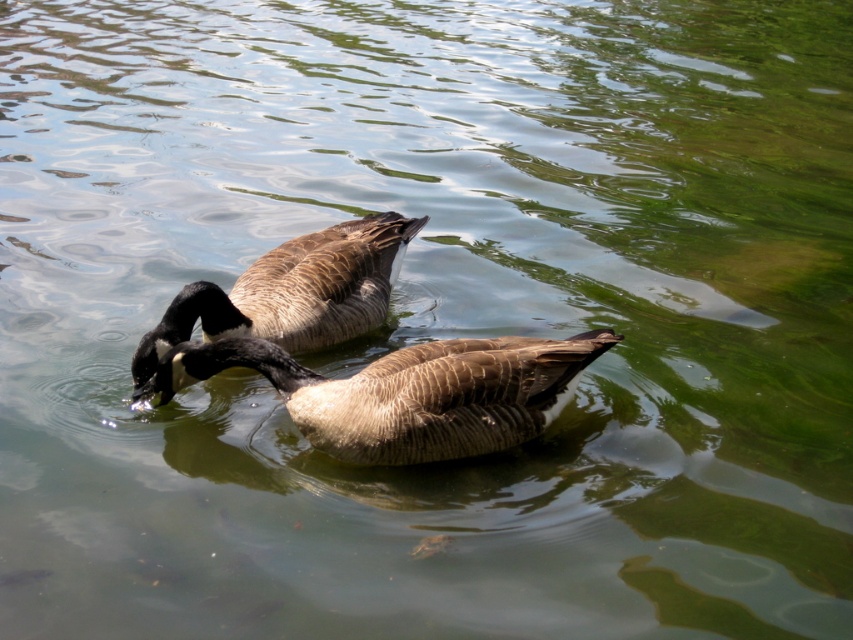
You are a birdwatcher observing two ducks in the water. You notice a brown textured duck at center and a brown feathered duck at center. Which duck is positioned lower in the water?

The brown textured duck at center is located below the brown feathered duck at center, so it is positioned lower in the water.

You are a wildlife photographer observing two ducks in the center of a pond. You notice a brown textured duck at center and a brown feathered duck at center. Which duck is larger?

The brown feathered duck at center is larger than the brown textured duck at center.

You are a birdwatcher observing two Canada geese swimming in a pond. You notice a point marked at coordinates (405, 392). Can you determine which object this point corresponds to among the two Canada geese?

The point at coordinates (405, 392) corresponds to the brown textured duck at center.